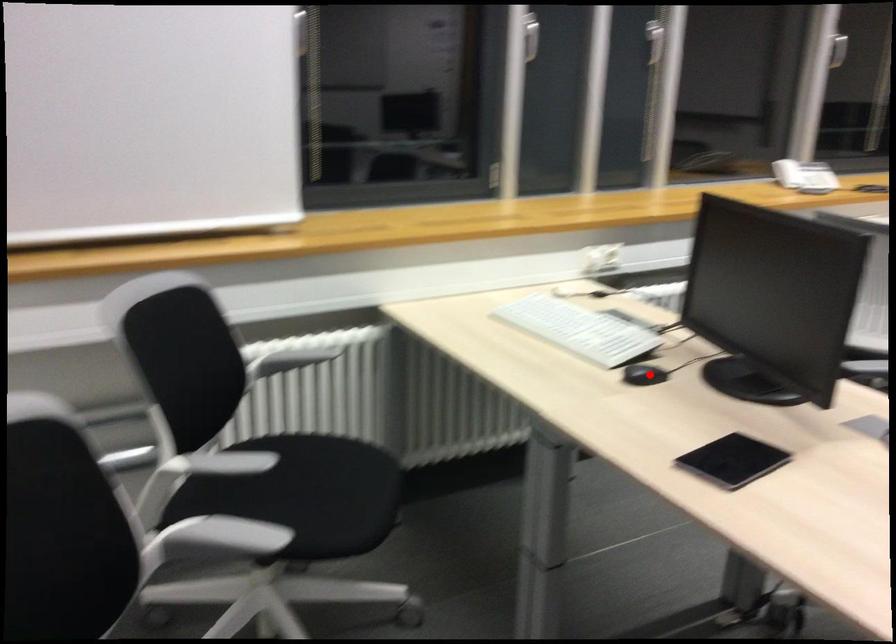
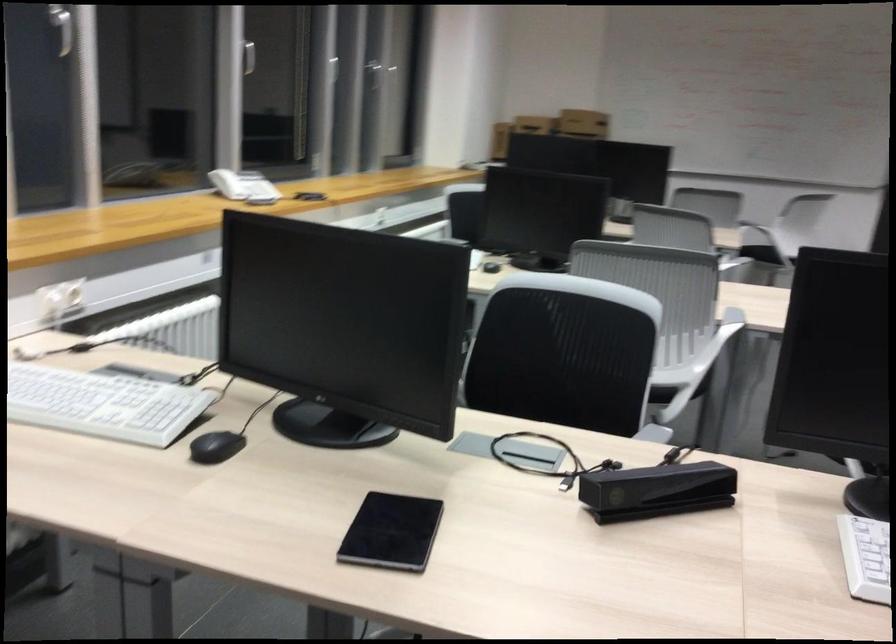
Question: I am providing you with two images of the same scene from different viewpoints. A red point is shown in image1. For the corresponding object point in image2, is it positioned nearer or farther from the camera?

Choices:
 (A) Nearer
 (B) Farther

Answer: (A)